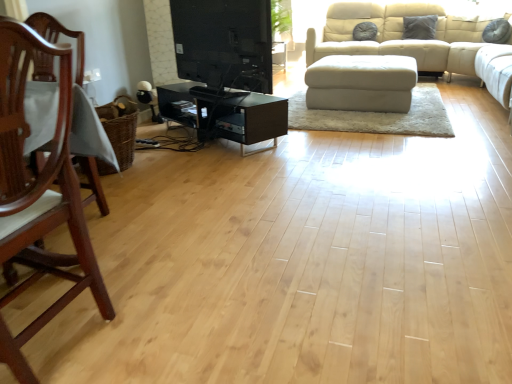
Question: Should I look upward or downward to see black glass tv stand at center?

Choices:
 (A) down
 (B) up

Answer: (B)

Question: Considering the relative sizes of mahogany wood chair at left and black glossy tv stand at center in the image provided, is mahogany wood chair at left bigger than black glossy tv stand at center?

Choices:
 (A) yes
 (B) no

Answer: (A)

Question: Is the position of mahogany wood chair at left less distant than that of black glossy tv stand at center?

Choices:
 (A) yes
 (B) no

Answer: (A)

Question: Does mahogany wood chair at left turn towards black glossy tv stand at center?

Choices:
 (A) no
 (B) yes

Answer: (A)

Question: Considering the relative sizes of mahogany wood chair at left and black glossy tv stand at center in the image provided, is mahogany wood chair at left wider than black glossy tv stand at center?

Choices:
 (A) yes
 (B) no

Answer: (A)

Question: From the image's perspective, is mahogany wood chair at left beneath black glossy tv stand at center?

Choices:
 (A) yes
 (B) no

Answer: (A)

Question: Is mahogany wood chair at left behind black glossy tv stand at center?

Choices:
 (A) no
 (B) yes

Answer: (A)

Question: From a real-world perspective, is black glossy tv stand at center over black glass tv stand at center?

Choices:
 (A) yes
 (B) no

Answer: (A)

Question: Is black glossy tv stand at center far from black glass tv stand at center?

Choices:
 (A) yes
 (B) no

Answer: (B)

Question: Does black glossy tv stand at center have a greater width compared to black glass tv stand at center?

Choices:
 (A) no
 (B) yes

Answer: (A)

Question: Does black glossy tv stand at center have a lesser height compared to black glass tv stand at center?

Choices:
 (A) no
 (B) yes

Answer: (A)

Question: Is black glossy tv stand at center positioned in front of black glass tv stand at center?

Choices:
 (A) yes
 (B) no

Answer: (A)

Question: Can you confirm if black glossy tv stand at center is bigger than black glass tv stand at center?

Choices:
 (A) yes
 (B) no

Answer: (B)

Question: Is mahogany wood chair at left positioned far away from white fabric ottoman at center?

Choices:
 (A) yes
 (B) no

Answer: (A)